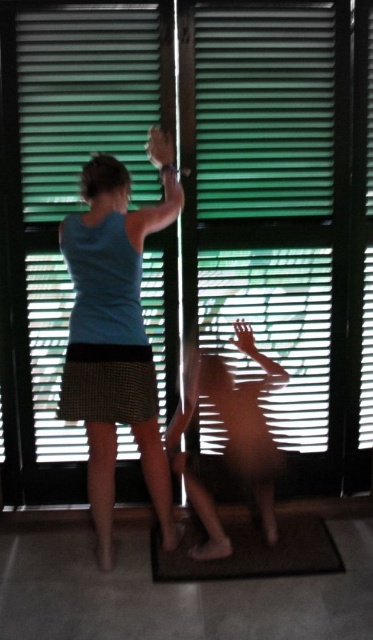
You are a photographer trying to capture the scene through the window. The blue fabric shirt at upper left is blocking the light. Can you estimate the coordinates where the shirt is located to adjust your camera angle?

The blue fabric shirt at upper left is located at coordinates point (x=116, y=333), so you can adjust your camera angle to avoid this area.

You are standing at the point marked as point (145, 19). The woman and the child are 8.62 feet apart. If you want to move closer to the child without getting in the way of the woman adjusting the blinds, which direction should you move?

Since the woman and the child are 8.62 feet apart, you should move towards the child while staying clear of the woman who is adjusting the blinds. The exact direction depends on their positions relative to point (145, 19), but generally moving towards the child while maintaining a safe distance from the woman would be advisable.

You are standing in the room and want to adjust the green matte blinds at upper center. You notice a point marked at coordinates (85, 100). Is this point on the green matte blinds at upper center?

Yes, the green matte blinds at upper center is located at point (85, 100), so the point is on the green matte blinds at upper center.